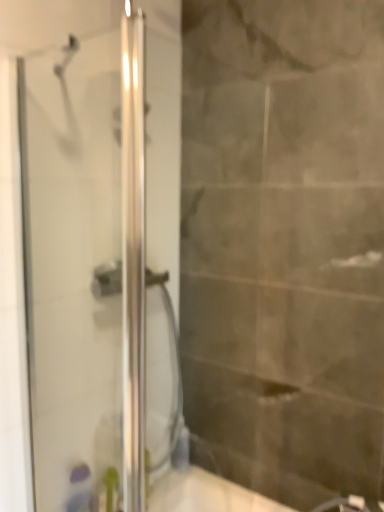
Question: Should I look upward or downward to see transparent glass shower door at left?

Choices:
 (A) up
 (B) down

Answer: (B)